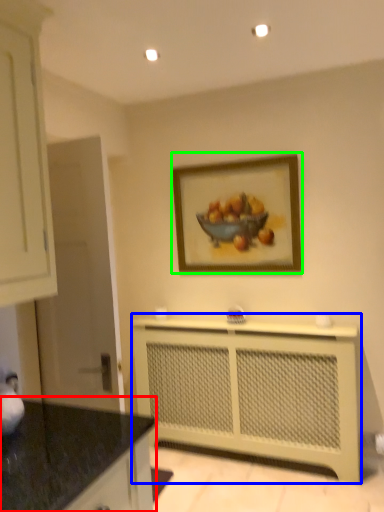
Question: Which object is positioned closest to countertop (highlighted by a red box)? Select from counter (highlighted by a blue box) and picture frame (highlighted by a green box).

Choices:
 (A) counter
 (B) picture frame

Answer: (A)